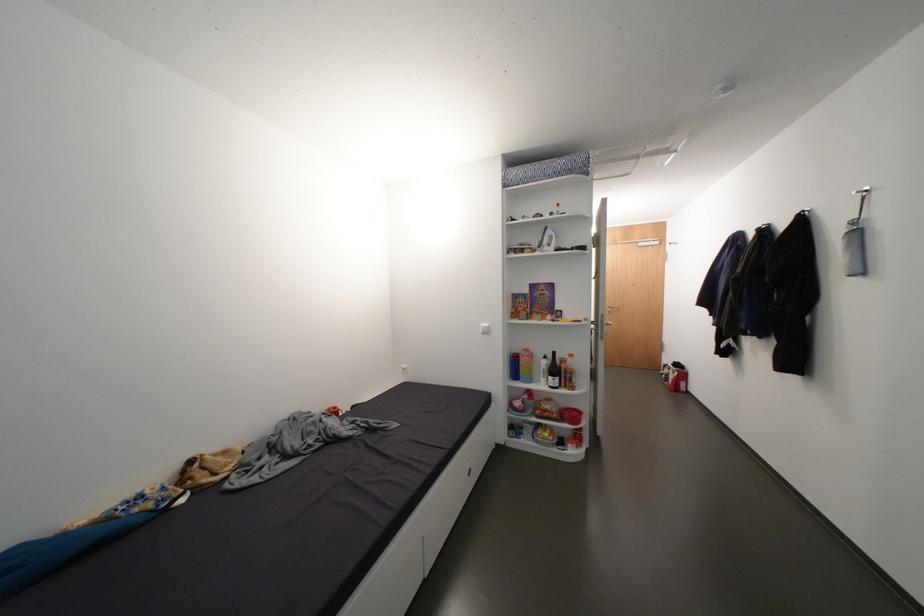
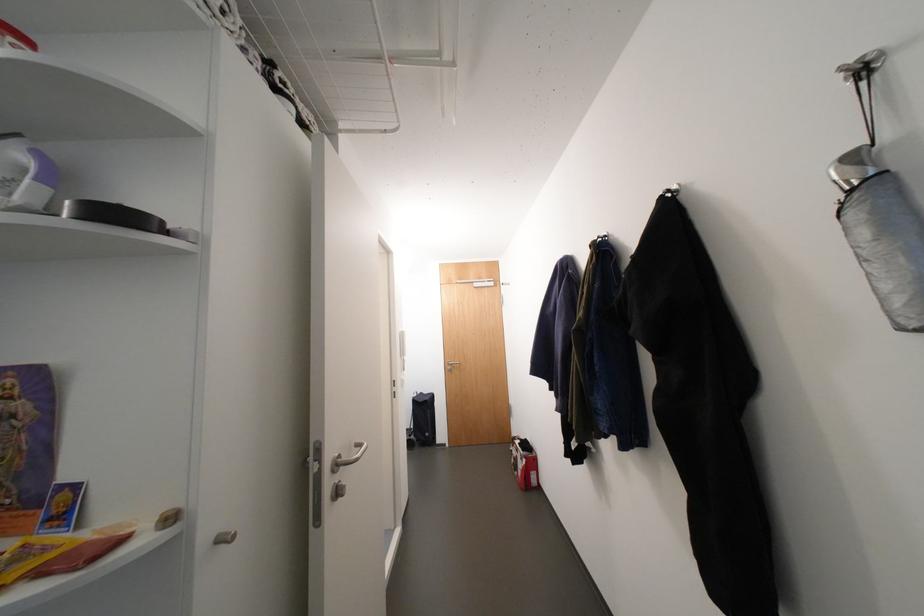
Locate, in the second image, the point that corresponds to [862,223] in the first image.

(864, 159)